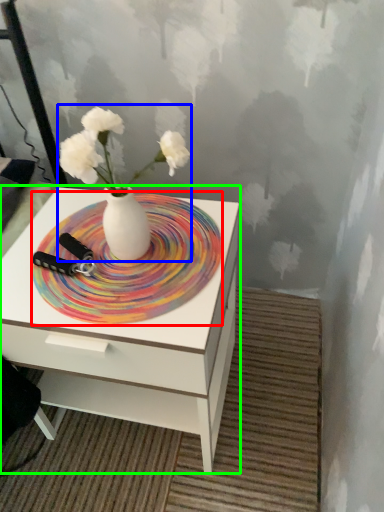
Question: Which object is the closest to the plate (highlighted by a red box)? Choose among these: floral arrangement (highlighted by a blue box) or nightstand (highlighted by a green box).

Choices:
 (A) floral arrangement
 (B) nightstand

Answer: (A)